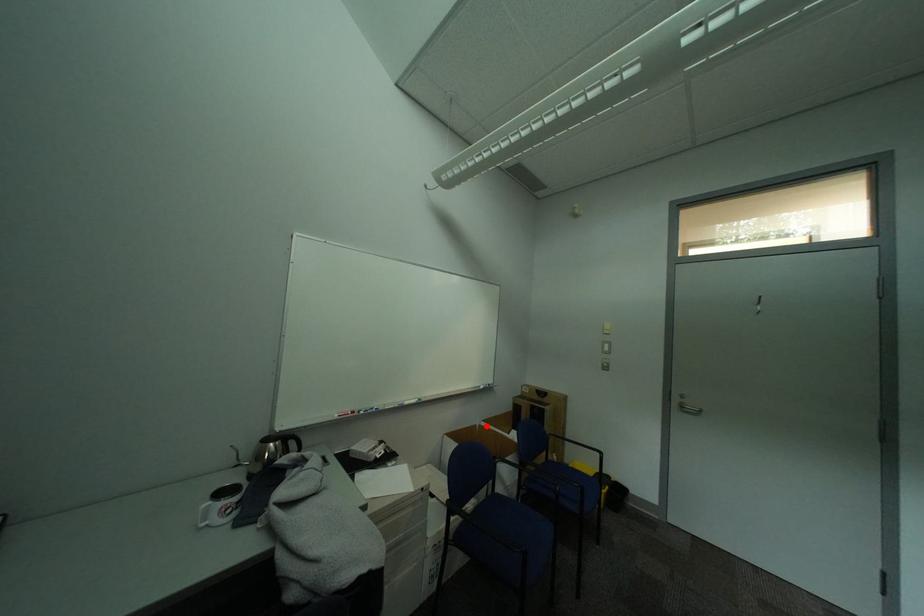
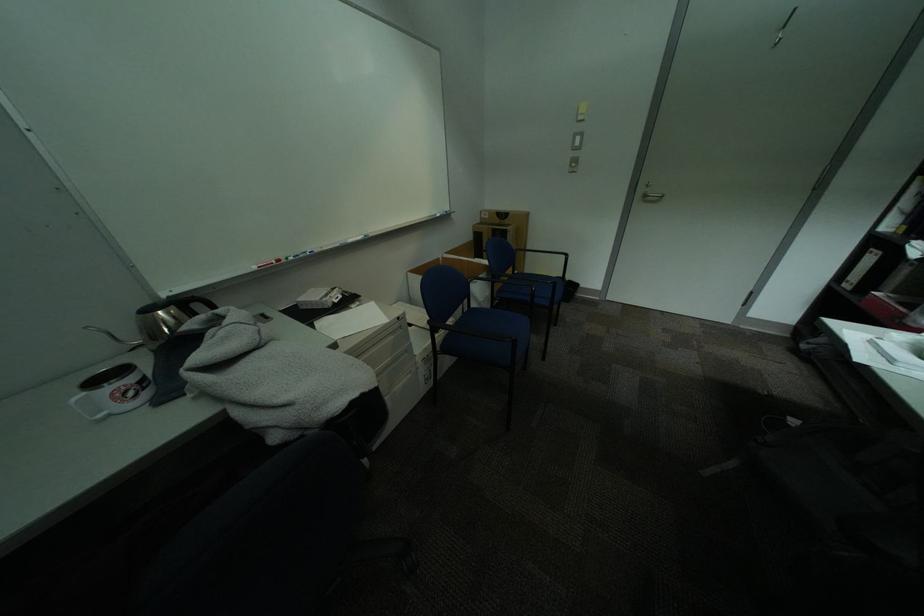
Question: I am providing you with two images of the same scene from different viewpoints. Given a red point in image1, look at the same physical point in image2. Is it:

Choices:
 (A) Closer to the viewpoint
 (B) Farther from the viewpoint

Answer: (A)